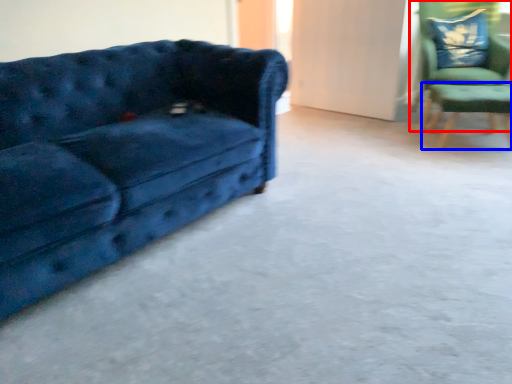
Question: Which object appears closest to the camera in this image, chair (highlighted by a red box) or side table (highlighted by a blue box)?

Choices:
 (A) chair
 (B) side table

Answer: (B)